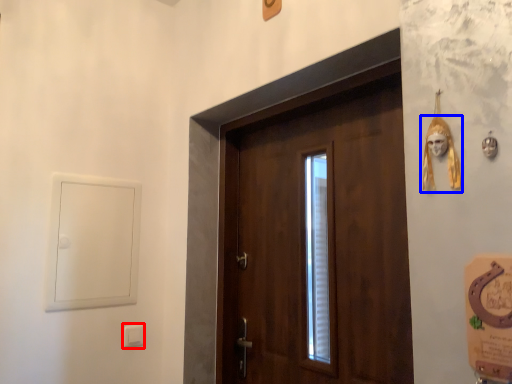
Question: Among these objects, which one is nearest to the camera, light switch (highlighted by a red box) or skull (highlighted by a blue box)?

Choices:
 (A) light switch
 (B) skull

Answer: (B)